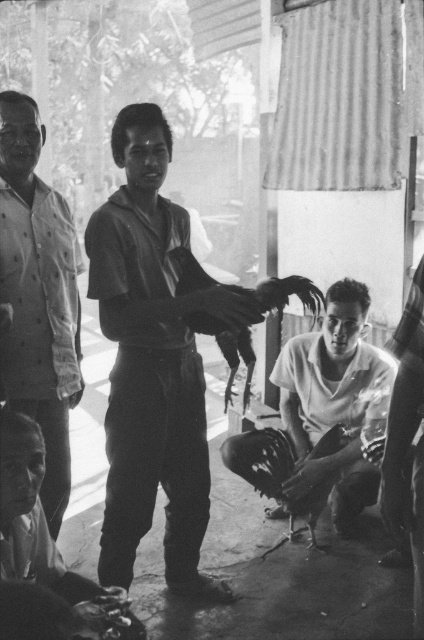
You are a photographer trying to capture a group photo of the smooth black shirt at center and the smooth white shirt at center. The camera you have can only focus on subjects within a 60 cm range. Will both subjects be in focus if they are positioned exactly as in the original photo?

The distance between the smooth black shirt at center and smooth white shirt at center is 73.86 centimeters. Since the camera requires subjects within 60 cm to be in focus, the two subjects will not both be in focus as they are beyond the camera range.

You are a tailor observing the two men in the photograph. You need to determine which shirt requires more fabric to make between the smooth black shirt at center and the smooth white shirt at center. Which one would need more fabric?

The smooth white shirt at center requires more fabric because its width is greater than the smooth black shirt at center.